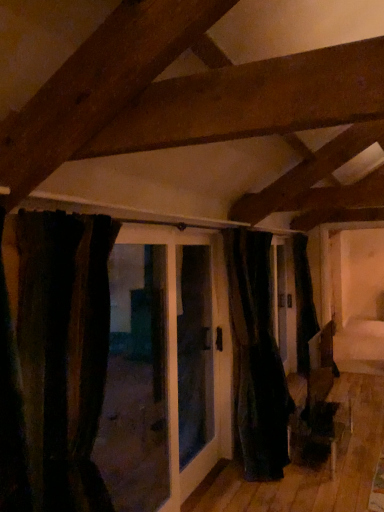
Question: Does black fabric door at center have a greater width compared to black velvet curtain at center, the second curtain from the left?

Choices:
 (A) yes
 (B) no

Answer: (A)

Question: From the image's perspective, does black fabric door at center appear lower than black velvet curtain at center, which appears as the second curtain when viewed from the front?

Choices:
 (A) no
 (B) yes

Answer: (A)

Question: Is black fabric door at center in contact with black velvet curtain at center, which is the first curtain in right-to-left order?

Choices:
 (A) no
 (B) yes

Answer: (A)

Question: Considering the relative sizes of black fabric door at center and black velvet curtain at center, which is the first curtain in right-to-left order, in the image provided, is black fabric door at center shorter than black velvet curtain at center, which is the first curtain in right-to-left order,?

Choices:
 (A) no
 (B) yes

Answer: (B)

Question: From a real-world perspective, is black fabric door at center beneath black velvet curtain at center, which appears as the second curtain when viewed from the front?

Choices:
 (A) yes
 (B) no

Answer: (B)

Question: Considering the relative positions of black fabric door at center and black velvet curtain at center, which appears as the second curtain when viewed from the front, in the image provided, is black fabric door at center to the right of black velvet curtain at center, which appears as the second curtain when viewed from the front, from the viewer's perspective?

Choices:
 (A) yes
 (B) no

Answer: (B)

Question: Would you say black velvet curtain at center, the second curtain from the left, contains black fabric door at center?

Choices:
 (A) no
 (B) yes

Answer: (A)

Question: Does black velvet curtain at center, which is the first curtain in right-to-left order, appear on the left side of black fabric door at center?

Choices:
 (A) no
 (B) yes

Answer: (A)

Question: Is black velvet curtain at center, the second curtain from the left, completely or partially outside of black fabric door at center?

Choices:
 (A) yes
 (B) no

Answer: (A)

Question: From the image's perspective, is black velvet curtain at center, which appears as the second curtain when viewed from the front, on top of black fabric door at center?

Choices:
 (A) no
 (B) yes

Answer: (A)

Question: Considering the relative sizes of black velvet curtain at center, which is the first curtain in right-to-left order, and black fabric door at center in the image provided, is black velvet curtain at center, which is the first curtain in right-to-left order, wider than black fabric door at center?

Choices:
 (A) yes
 (B) no

Answer: (B)

Question: Is black velvet curtain at center, marked as the 1th curtain in a back-to-front arrangement, not close to black fabric door at center?

Choices:
 (A) no
 (B) yes

Answer: (A)

Question: Does black fabric door at center have a smaller size compared to dark velvet curtain at left, which is counted as the first curtain, starting from the front?

Choices:
 (A) no
 (B) yes

Answer: (A)